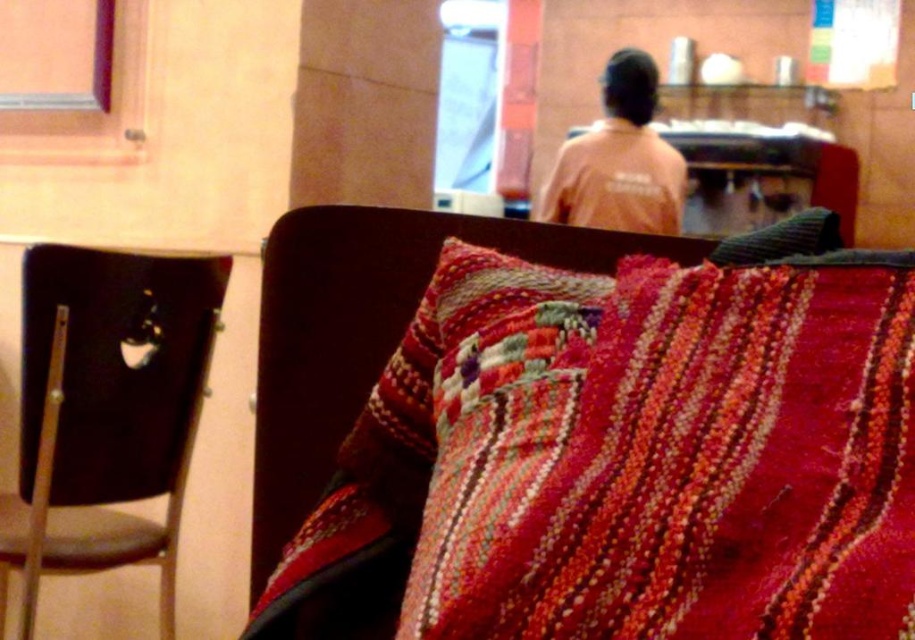
Question: Is the position of wooden cushion at center less distant than that of textured gray pillow at center?

Choices:
 (A) no
 (B) yes

Answer: (B)

Question: Considering the relative positions of wooden cushion at center and orange cotton shirt at upper center in the image provided, where is wooden cushion at center located with respect to orange cotton shirt at upper center?

Choices:
 (A) above
 (B) below

Answer: (B)

Question: Which point is farther from the camera taking this photo?

Choices:
 (A) (121, 339)
 (B) (556, 323)
 (C) (666, 484)
 (D) (784, 236)

Answer: (A)

Question: Which point is farther to the camera?

Choices:
 (A) textured gray pillow at center
 (B) orange cotton shirt at upper center

Answer: (A)

Question: Observing the image, what is the correct spatial positioning of brown plastic chair at left in reference to wooden cushion at center?

Choices:
 (A) left
 (B) right

Answer: (A)

Question: Which object appears farthest from the camera in this image?

Choices:
 (A) knitted fabric pillow at center
 (B) brown plastic chair at left

Answer: (B)